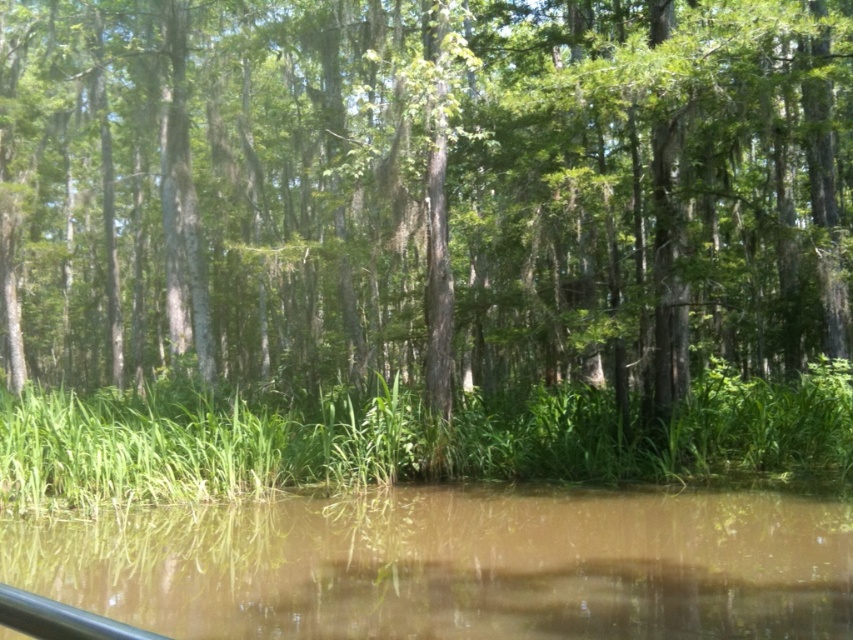
Question: Where is green matte tree at center located in relation to black rubber rail at lower left in the image?

Choices:
 (A) above
 (B) below

Answer: (A)

Question: Considering the real-world distances, which object is closest to the brown muddy water at lower center?

Choices:
 (A) green matte tree at center
 (B) black rubber rail at lower left

Answer: (B)

Question: Which of the following is the closest to the observer?

Choices:
 (A) black rubber rail at lower left
 (B) brown muddy water at lower center

Answer: (A)

Question: Is brown muddy water at lower center positioned in front of black rubber rail at lower left?

Choices:
 (A) no
 (B) yes

Answer: (A)

Question: Is the position of green matte tree at center more distant than that of black rubber rail at lower left?

Choices:
 (A) no
 (B) yes

Answer: (B)

Question: Which point appears farthest from the camera in this image?

Choices:
 (A) (747, 76)
 (B) (64, 636)

Answer: (A)